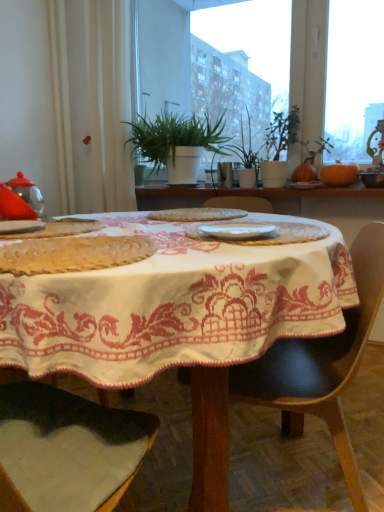
Question: Is white embroidered tablecloth at center to the right of green leafy plants at upper center from the viewer's perspective?

Choices:
 (A) no
 (B) yes

Answer: (A)

Question: Is green leafy plants at upper center inside white embroidered tablecloth at center?

Choices:
 (A) no
 (B) yes

Answer: (A)

Question: Is white embroidered tablecloth at center not close to green leafy plants at upper center?

Choices:
 (A) no
 (B) yes

Answer: (B)

Question: Is white embroidered tablecloth at center taller than green leafy plants at upper center?

Choices:
 (A) yes
 (B) no

Answer: (B)

Question: From the image's perspective, is white embroidered tablecloth at center located beneath green leafy plants at upper center?

Choices:
 (A) no
 (B) yes

Answer: (B)

Question: From a real-world perspective, is white embroidered tablecloth at center physically above green leafy plants at upper center?

Choices:
 (A) no
 (B) yes

Answer: (A)

Question: Is green leafy plant at center, positioned as the second houseplant in right-to-left order, at the back of green leafy plants at upper center?

Choices:
 (A) no
 (B) yes

Answer: (B)

Question: Can you confirm if green leafy plants at upper center is bigger than green leafy plant at center, positioned as the second houseplant in right-to-left order?

Choices:
 (A) yes
 (B) no

Answer: (A)

Question: Are green leafy plants at upper center and green leafy plant at center, the first houseplant when ordered from left to right, far apart?

Choices:
 (A) no
 (B) yes

Answer: (A)

Question: Does green leafy plants at upper center come in front of green leafy plant at center, the first houseplant when ordered from left to right?

Choices:
 (A) no
 (B) yes

Answer: (B)

Question: Is green leafy plants at upper center surrounding green leafy plant at center, positioned as the second houseplant in right-to-left order?

Choices:
 (A) yes
 (B) no

Answer: (B)

Question: Does green leafy plants at upper center appear on the right side of green leafy plant at center, positioned as the second houseplant in right-to-left order?

Choices:
 (A) no
 (B) yes

Answer: (B)

Question: From the image's perspective, would you say black leather chair at center is positioned over green matte plant at center, which is counted as the 2th houseplant, starting from the left?

Choices:
 (A) no
 (B) yes

Answer: (A)